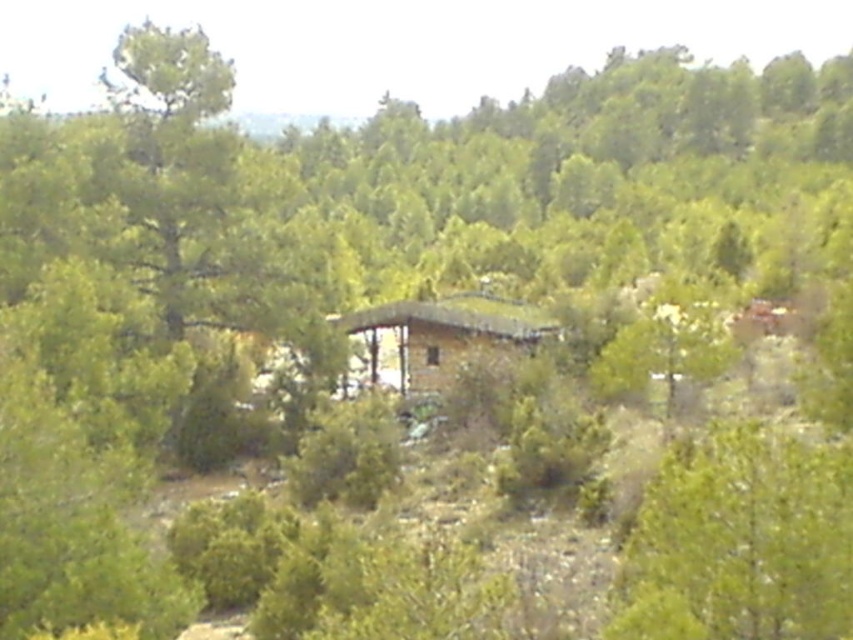
Can you confirm if green leafy tree at lower right is shorter than wooden cabin at center?

Yes, green leafy tree at lower right is shorter than wooden cabin at center.

Between green leafy tree at lower right and wooden cabin at center, which one appears on the left side from the viewer's perspective?

Positioned to the left is wooden cabin at center.

Between point (729, 529) and point (412, 372), which one is positioned behind?

The point (412, 372) is behind.

You are a GUI agent. You are given a task and a screenshot of the screen. Output one action in this format:
    pyautogui.click(x=<x>, y=<y>)
    Task: Click on the green leafy tree at lower right
    This screenshot has height=640, width=853.
    Given the screenshot: What is the action you would take?
    pyautogui.click(x=741, y=540)